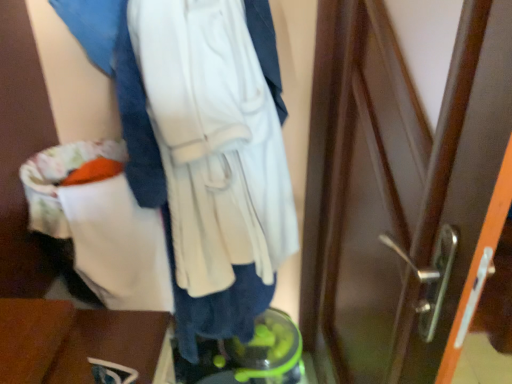
Question: In the image, is wooden table at lower left on the left side or the right side of white soft sweatshirt at center?

Choices:
 (A) right
 (B) left

Answer: (B)

Question: Which is correct: wooden table at lower left is inside white soft sweatshirt at center, or outside of it?

Choices:
 (A) outside
 (B) inside

Answer: (A)

Question: In the image, is wooden table at lower left positioned in front of or behind white soft sweatshirt at center?

Choices:
 (A) front
 (B) behind

Answer: (B)

Question: From their relative heights in the image, would you say white soft sweatshirt at center is taller or shorter than wooden table at lower left?

Choices:
 (A) tall
 (B) short

Answer: (A)

Question: From a real-world perspective, relative to wooden table at lower left, is white soft sweatshirt at center vertically above or below?

Choices:
 (A) below
 (B) above

Answer: (B)

Question: Is white soft sweatshirt at center bigger or smaller than wooden table at lower left?

Choices:
 (A) big
 (B) small

Answer: (A)

Question: In the image, is white soft sweatshirt at center positioned in front of or behind wooden table at lower left?

Choices:
 (A) behind
 (B) front

Answer: (B)